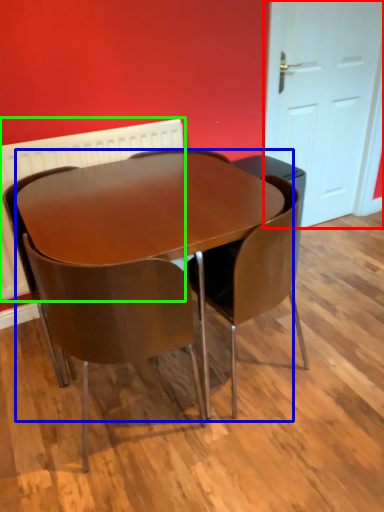
Question: Based on their relative distances, which object is nearer to door (highlighted by a red box)? Choose from table (highlighted by a blue box) and radiator (highlighted by a green box).

Choices:
 (A) table
 (B) radiator

Answer: (B)